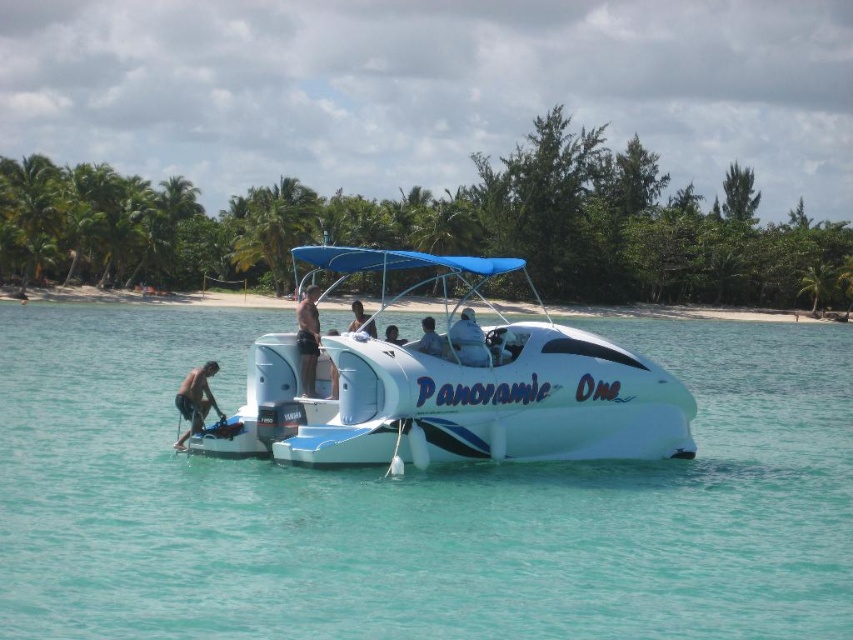
Question: Which object is the closest to the dark brown shorts at center?

Choices:
 (A) white glossy boat at center
 (B) skinny man at lower left

Answer: (B)

Question: Does white glossy boat at center have a smaller size compared to dark brown shorts at center?

Choices:
 (A) no
 (B) yes

Answer: (A)

Question: Does white glossy water at center appear on the left side of matte white shirt at center?

Choices:
 (A) yes
 (B) no

Answer: (A)

Question: Which point appears closest to the camera in this image?

Choices:
 (A) (532, 582)
 (B) (372, 333)
 (C) (428, 320)
 (D) (193, 392)

Answer: (A)

Question: Is white glossy water at center to the left of smooth tan skin at center from the viewer's perspective?

Choices:
 (A) yes
 (B) no

Answer: (B)

Question: Which of the following is the farthest from the observer?

Choices:
 (A) smooth tan skin at center
 (B) matte white shirt at center
 (C) smooth skin person at center

Answer: (A)